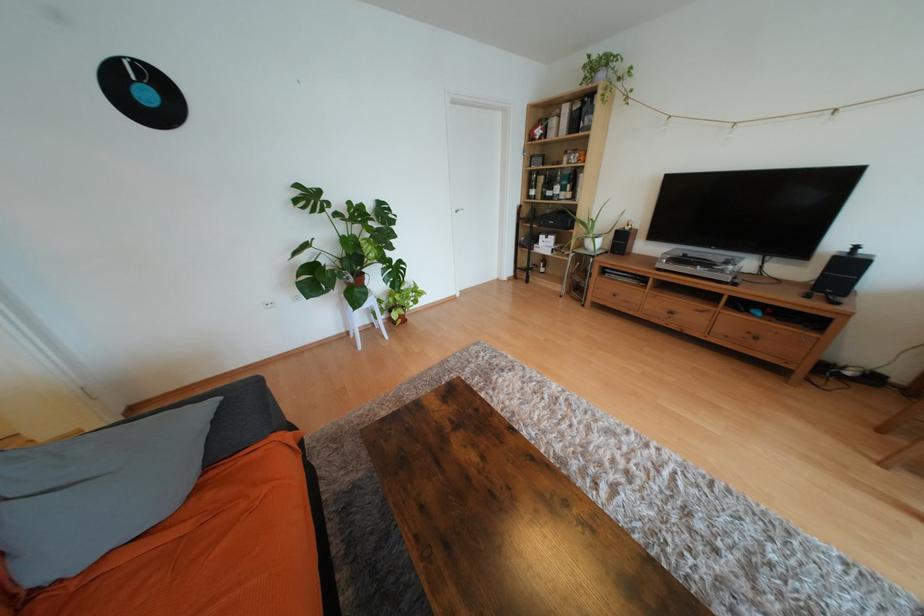
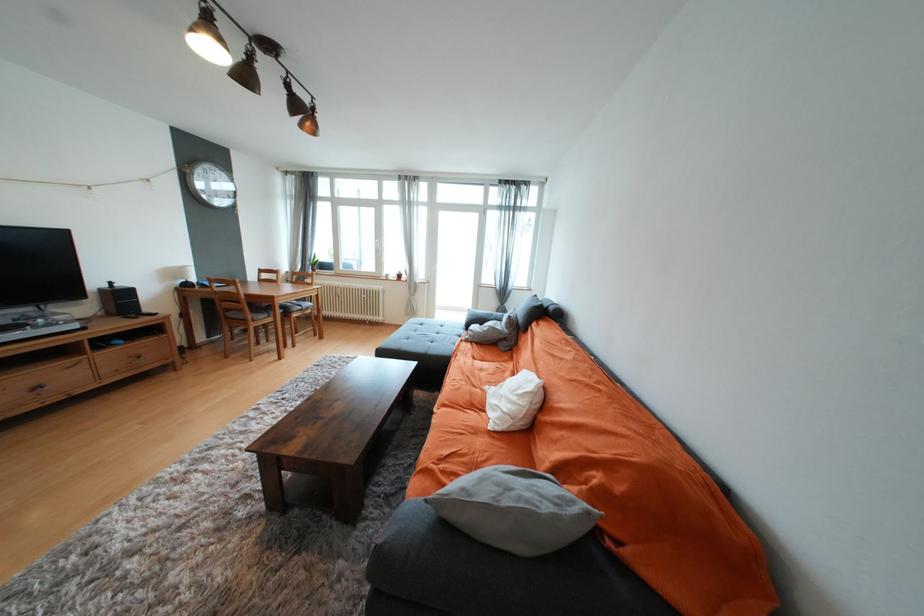
Where in the second image is the point corresponding to point 762,339 from the first image?

(146, 358)